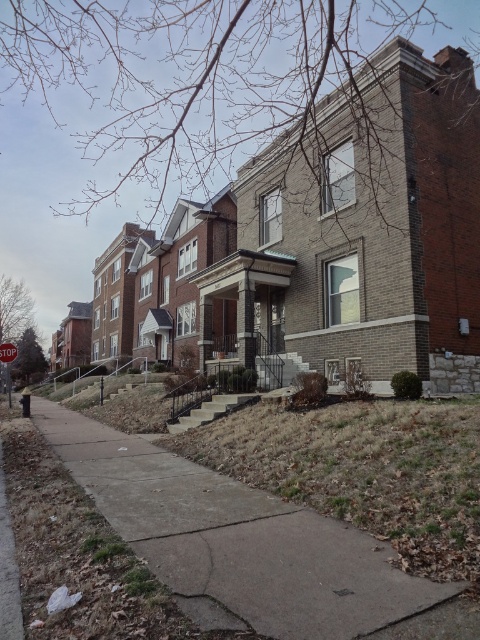
Is red stop sign at top bigger than red plastic stop sign at top?

Correct, red stop sign at top is larger in size than red plastic stop sign at top.

The width and height of the screenshot is (480, 640). Find the location of `red stop sign at top`. red stop sign at top is located at coordinates (8, 364).

Find the location of a particular element. Image resolution: width=480 pixels, height=640 pixels. red stop sign at top is located at coordinates (8, 364).

Does concrete at lower left have a larger size compared to red stop sign at top?

Actually, concrete at lower left might be smaller than red stop sign at top.

What do you see at coordinates (248, 545) in the screenshot?
I see `concrete at lower left` at bounding box center [248, 545].

I want to click on concrete at lower left, so click(x=248, y=545).

Can you confirm if concrete at lower left is shorter than red plastic stop sign at top?

Yes, concrete at lower left is shorter than red plastic stop sign at top.

Does concrete at lower left appear on the right side of red plastic stop sign at top?

Indeed, concrete at lower left is positioned on the right side of red plastic stop sign at top.

Who is more distant from viewer, (69, 410) or (12, 356)?

The point (69, 410) is behind.

I want to click on concrete at lower left, so click(248, 545).